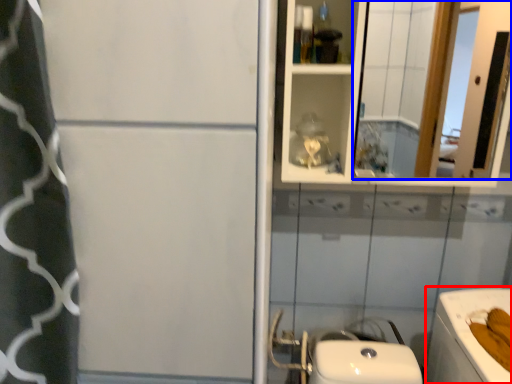
Question: Which of the following is the closest to the observer, bath (highlighted by a red box) or mirror (highlighted by a blue box)?

Choices:
 (A) bath
 (B) mirror

Answer: (A)